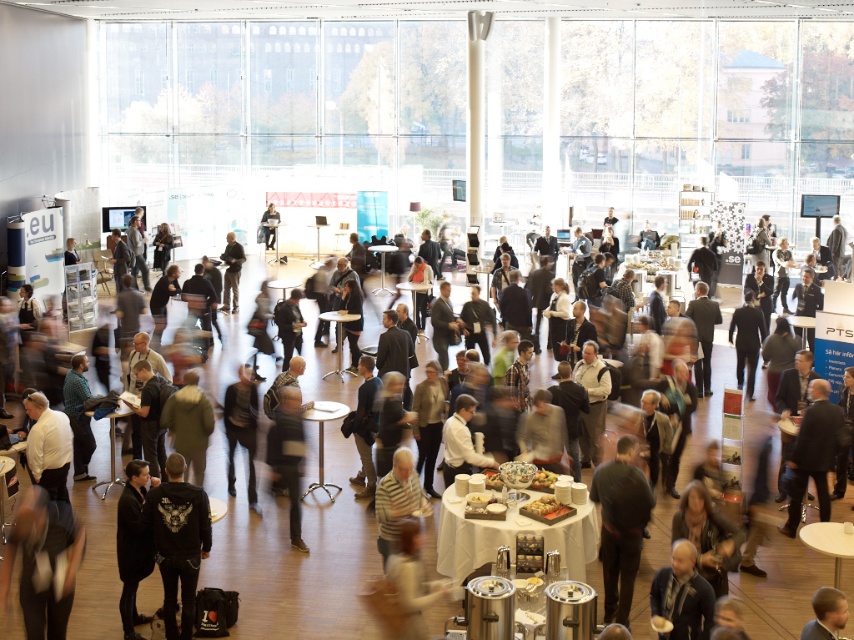
Question: Does black matte jacket at lower left appear under dark gray jacket at center?

Choices:
 (A) no
 (B) yes

Answer: (B)

Question: Which object is farther from the camera taking this photo?

Choices:
 (A) dark brown leather jacket at center
 (B) dark gray jacket at center
 (C) dark gray sweater at center

Answer: (B)

Question: Can you confirm if black matte jacket at lower left is positioned to the right of dark gray sweater at center?

Choices:
 (A) yes
 (B) no

Answer: (B)

Question: Among these points, which one is farthest from the camera?

Choices:
 (A) (171, 529)
 (B) (270, 202)
 (C) (237, 280)
 (D) (630, 493)

Answer: (B)

Question: Which point appears closest to the camera in this image?

Choices:
 (A) (623, 624)
 (B) (227, 236)
 (C) (281, 449)

Answer: (A)

Question: Observing the image, what is the correct spatial positioning of black matte jacket at lower left in reference to dark gray suit at center?

Choices:
 (A) below
 (B) above

Answer: (A)